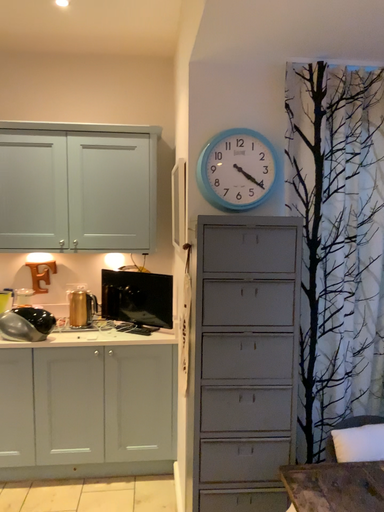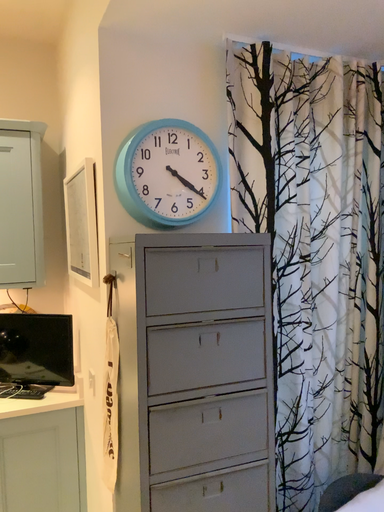
Question: Which way did the camera rotate in the video?

Choices:
 (A) rotated left
 (B) rotated right

Answer: (B)